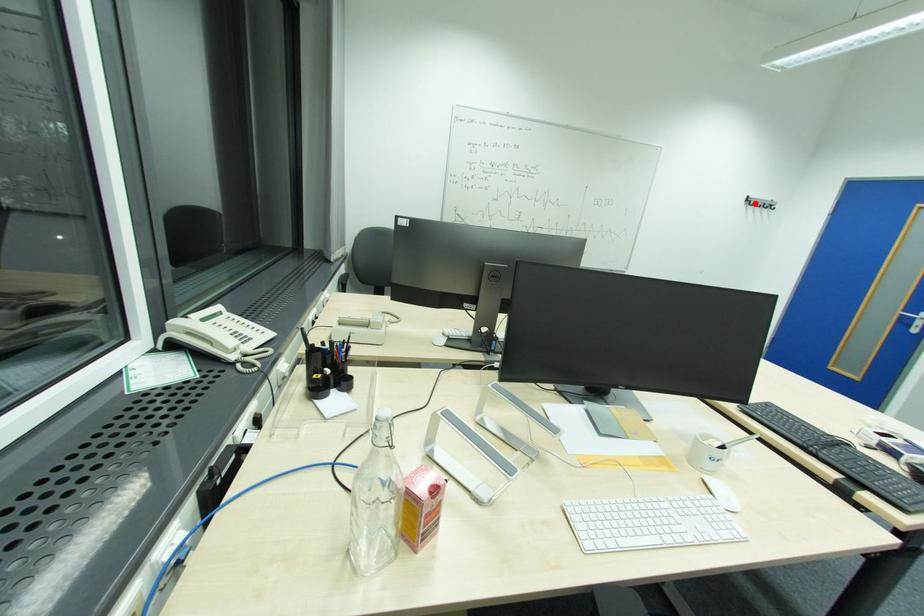
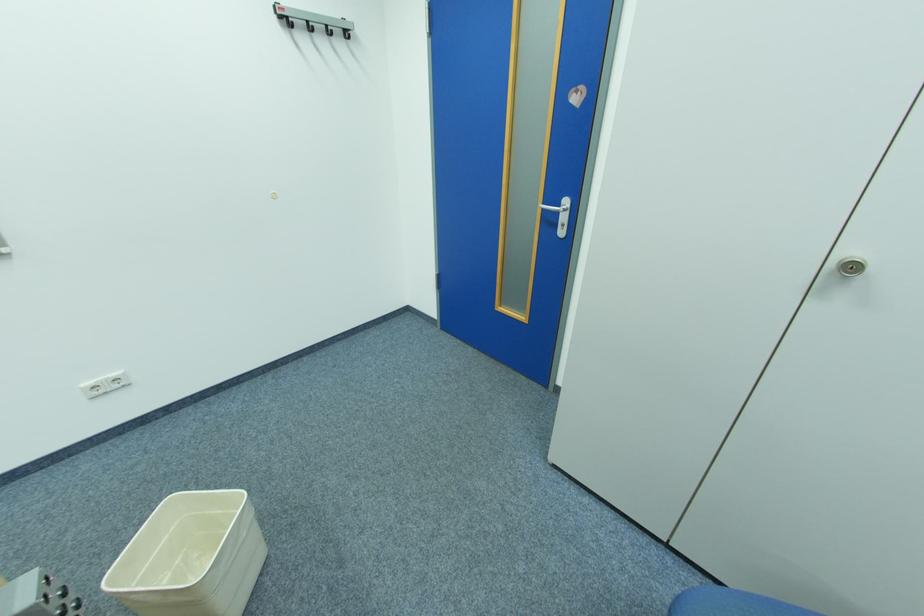
The point at the highlighted location is marked in the first image. Where is the corresponding point in the second image?

(290, 25)